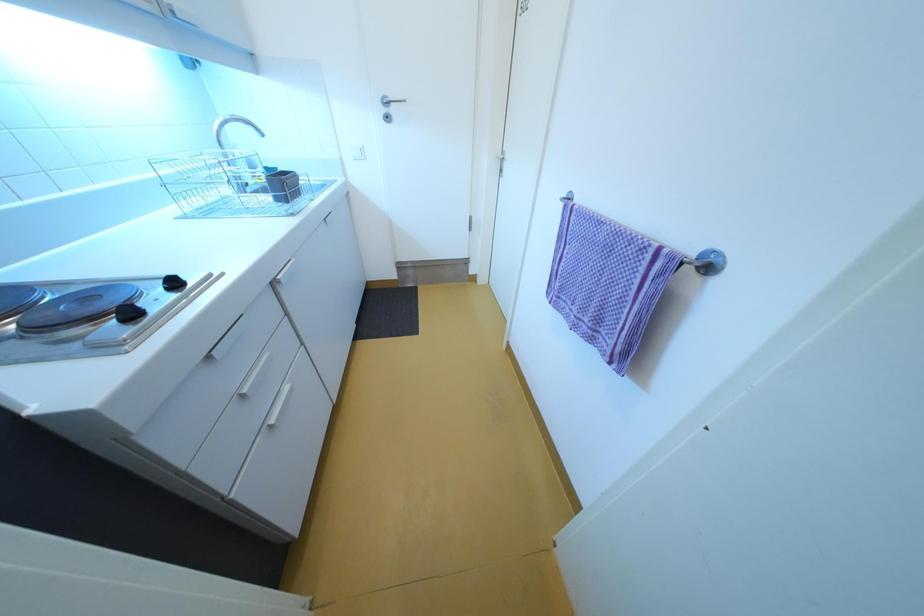
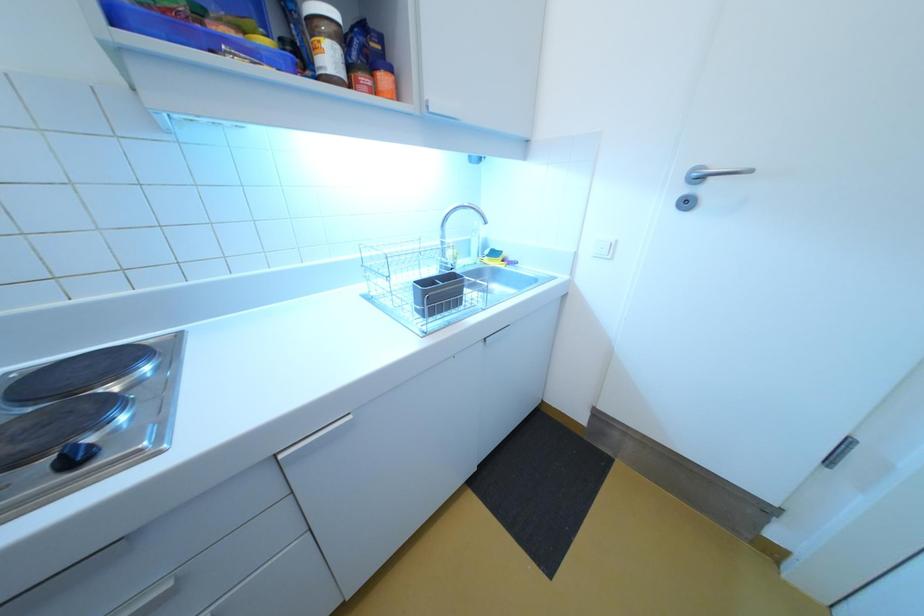
Question: The images are taken continuously from a first-person perspective. In which direction is your viewpoint rotating?

Choices:
 (A) Left
 (B) Right
 (C) Up
 (D) Down

Answer: (A)